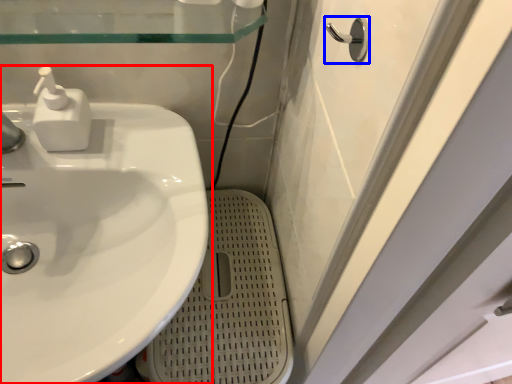
Question: Among these objects, which one is farthest to the camera, sink (highlighted by a red box) or door handle (highlighted by a blue box)?

Choices:
 (A) sink
 (B) door handle

Answer: (A)